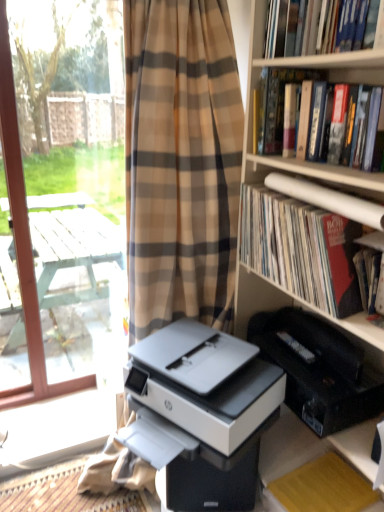
Question: Is matte paper book at right, which is the first book in bottom-to-top order, completely or partially outside of white wood screen door at left?

Choices:
 (A) yes
 (B) no

Answer: (A)

Question: Considering the relative positions of matte paper book at right, which is the first book in bottom-to-top order, and white wood screen door at left in the image provided, is matte paper book at right, which is the first book in bottom-to-top order, to the right of white wood screen door at left from the viewer's perspective?

Choices:
 (A) yes
 (B) no

Answer: (A)

Question: Are matte paper book at right, which is the third book in top-to-bottom order, and white wood screen door at left beside each other?

Choices:
 (A) no
 (B) yes

Answer: (A)

Question: Considering the relative sizes of matte paper book at right, which is the third book in top-to-bottom order, and white wood screen door at left in the image provided, is matte paper book at right, which is the third book in top-to-bottom order, shorter than white wood screen door at left?

Choices:
 (A) yes
 (B) no

Answer: (A)

Question: Can you confirm if matte paper book at right, which is the third book in top-to-bottom order, is taller than white wood screen door at left?

Choices:
 (A) no
 (B) yes

Answer: (A)

Question: In the image, is white plastic printer at center, which is counted as the first printer, starting from the left, positioned in front of or behind hardcover book at upper right, positioned as the second book in bottom-to-top order?

Choices:
 (A) behind
 (B) front

Answer: (A)

Question: Considering the relative positions of white plastic printer at center, which is counted as the first printer, starting from the left, and hardcover book at upper right, positioned as the second book in bottom-to-top order, in the image provided, is white plastic printer at center, which is counted as the first printer, starting from the left, to the left or to the right of hardcover book at upper right, positioned as the second book in bottom-to-top order,?

Choices:
 (A) left
 (B) right

Answer: (A)

Question: Considering the positions of white plastic printer at center, which appears as the second printer when viewed from the right, and hardcover book at upper right, positioned as the second book in bottom-to-top order, in the image, is white plastic printer at center, which appears as the second printer when viewed from the right, taller or shorter than hardcover book at upper right, positioned as the second book in bottom-to-top order,?

Choices:
 (A) tall
 (B) short

Answer: (B)

Question: Is white plastic printer at center, which appears as the second printer when viewed from the right, bigger or smaller than hardcover book at upper right, marked as the second book in a top-to-bottom arrangement?

Choices:
 (A) big
 (B) small

Answer: (A)

Question: Considering the positions of yellow paper at lower right and matte paper book at right, which is the first book in bottom-to-top order, in the image, is yellow paper at lower right wider or thinner than matte paper book at right, which is the first book in bottom-to-top order,?

Choices:
 (A) wide
 (B) thin

Answer: (A)

Question: Is yellow paper at lower right in front of or behind matte paper book at right, which is the third book in top-to-bottom order, in the image?

Choices:
 (A) behind
 (B) front

Answer: (A)

Question: In terms of height, does yellow paper at lower right look taller or shorter compared to matte paper book at right, which is the third book in top-to-bottom order?

Choices:
 (A) short
 (B) tall

Answer: (A)

Question: From a real-world perspective, is yellow paper at lower right physically located above or below matte paper book at right, which is the first book in bottom-to-top order?

Choices:
 (A) below
 (B) above

Answer: (A)

Question: Relative to matte paper book at right, which is the third book in top-to-bottom order, is white plastic printer at center, which is counted as the first printer, starting from the left, in front or behind?

Choices:
 (A) front
 (B) behind

Answer: (A)

Question: From the image's perspective, relative to matte paper book at right, which is the third book in top-to-bottom order, is white plastic printer at center, which is counted as the first printer, starting from the left, above or below?

Choices:
 (A) below
 (B) above

Answer: (A)